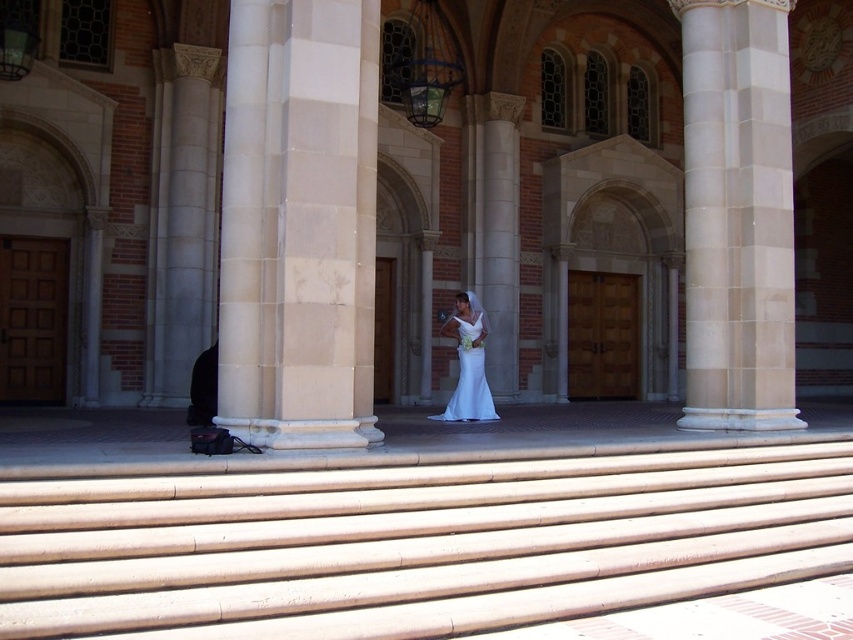
You are standing at the bottom of the smooth concrete stairs at center and want to reach the white satin dress at center. In which direction should you move to get closer to the dress?

Answer: You should move to the right because the smooth concrete stairs at center is to the left of the white satin dress at center, so moving right will bring you closer to the dress.

You are a photographer planning to take a portrait of a person wearing the white satin dress at center in front of the beige marble column at center. Considering the height difference between them, which object should you position closer to the camera to ensure both are fully visible in the frame?

The beige marble column at center is much taller than the white satin dress at center, so positioning the white satin dress at center closer to the camera will help ensure both are fully visible in the frame.

You are standing at the bottom of the steps leading to the entrance of the grand building. You need to walk to the beige marble column at center and the white satin dress at center. Which object is farther from your current position?

The beige marble column at center is farther from your current position because it is 4.40 meters away from the white satin dress at center, implying that the column is further back along the path.